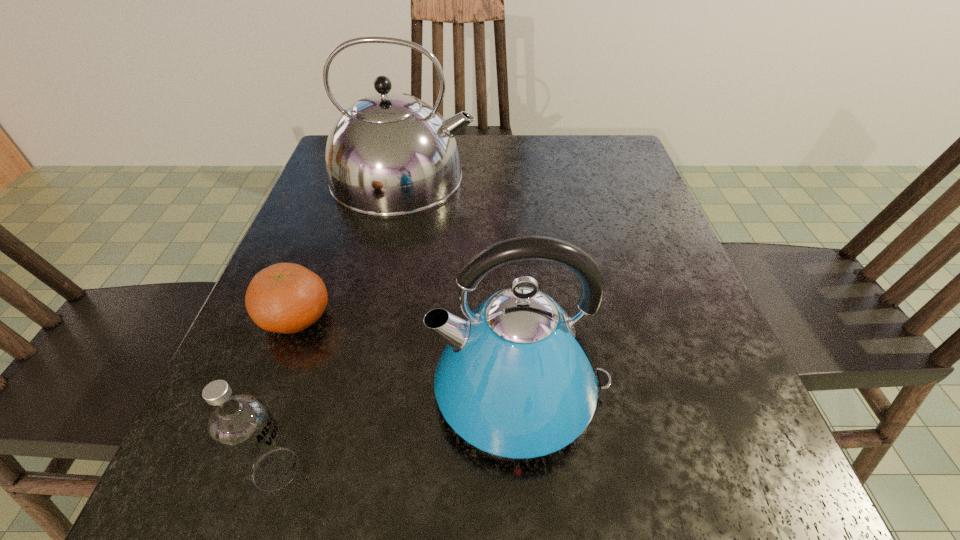
Locate an element on the screen. object that is at the far edge is located at coordinates [389, 154].

Locate an element on the screen. kettle located at the near edge is located at coordinates (516, 379).

Locate an element on the screen. vodka located in the near edge section of the desktop is located at coordinates coord(241,426).

The height and width of the screenshot is (540, 960). Find the location of `kettle at the left edge`. kettle at the left edge is located at coordinates (389, 154).

Where is `vodka positioned at the left edge`? This screenshot has height=540, width=960. vodka positioned at the left edge is located at coordinates (241, 426).

Where is `clementine located in the left edge section of the desktop`? clementine located in the left edge section of the desktop is located at coordinates (288, 298).

Where is `object that is positioned at the far left corner`? The height and width of the screenshot is (540, 960). object that is positioned at the far left corner is located at coordinates (389, 154).

Image resolution: width=960 pixels, height=540 pixels. Find the location of `object that is at the near left corner`. object that is at the near left corner is located at coordinates (241, 426).

This screenshot has height=540, width=960. In the image, there is a desktop. Identify the location of vacant space at the left edge. (263, 364).

Where is `free space at the right edge`? This screenshot has height=540, width=960. free space at the right edge is located at coordinates (649, 343).